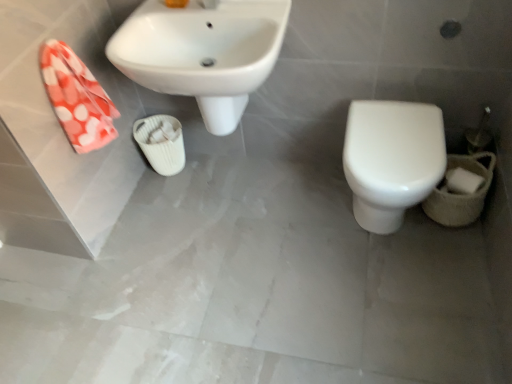
I want to click on free spot below orange polka dot fabric at left (from a real-world perspective), so click(139, 206).